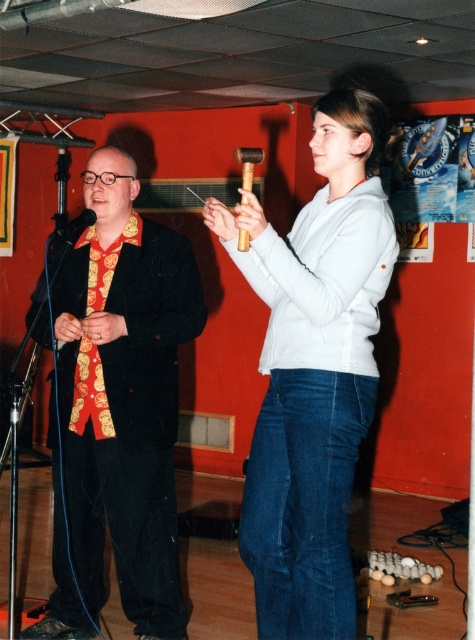
You are attending a presentation and notice the matte black suit at left and the black matte microphone at left. Which object is taller?

The matte black suit at left is taller than the black matte microphone at left.

Based on the coordinates provided, what object is located at point (313, 371) in the image?

The point (313, 371) corresponds to the white matte sweater at center.